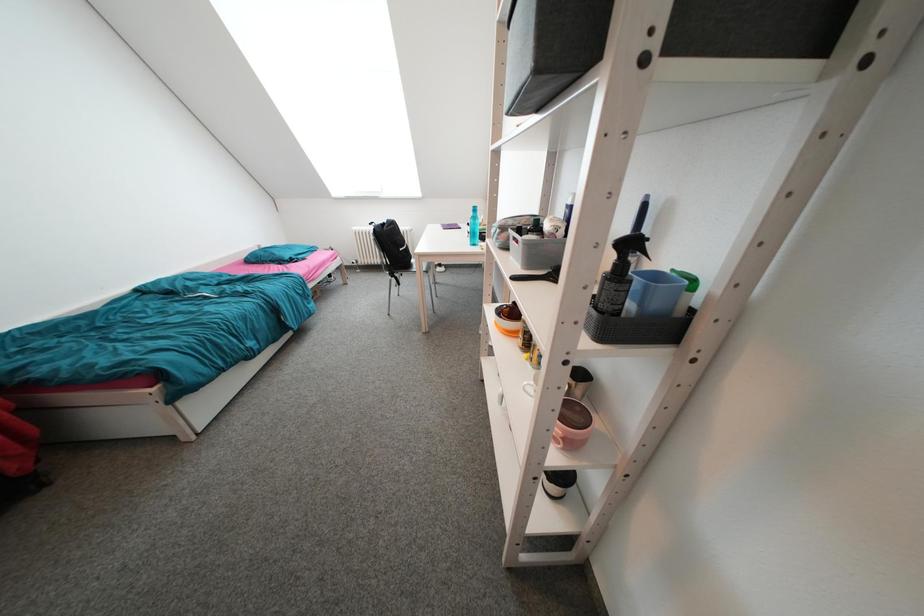
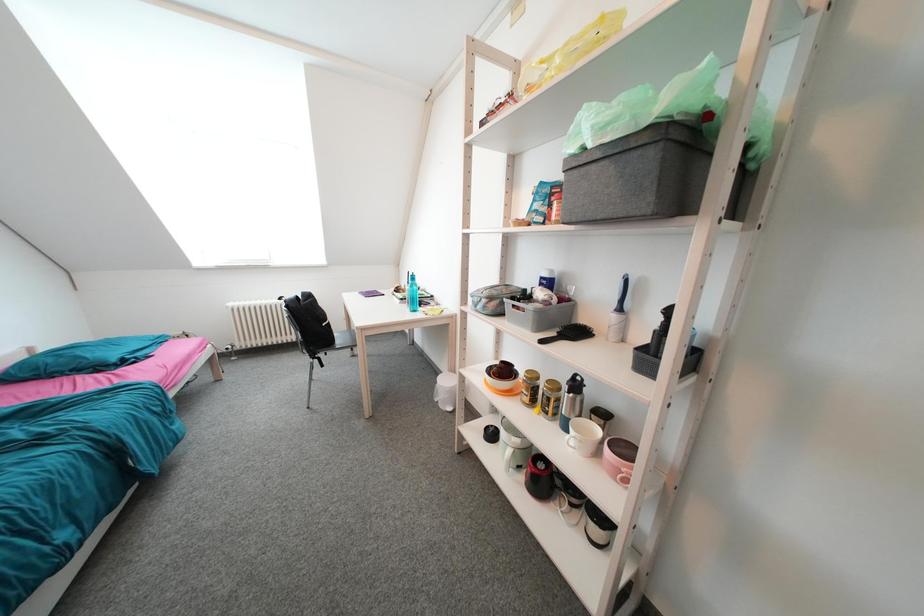
Question: In a continuous first-person perspective shot, in which direction is the camera moving?

Choices:
 (A) Left
 (B) Right
 (C) Forward
 (D) Backward

Answer: (A)